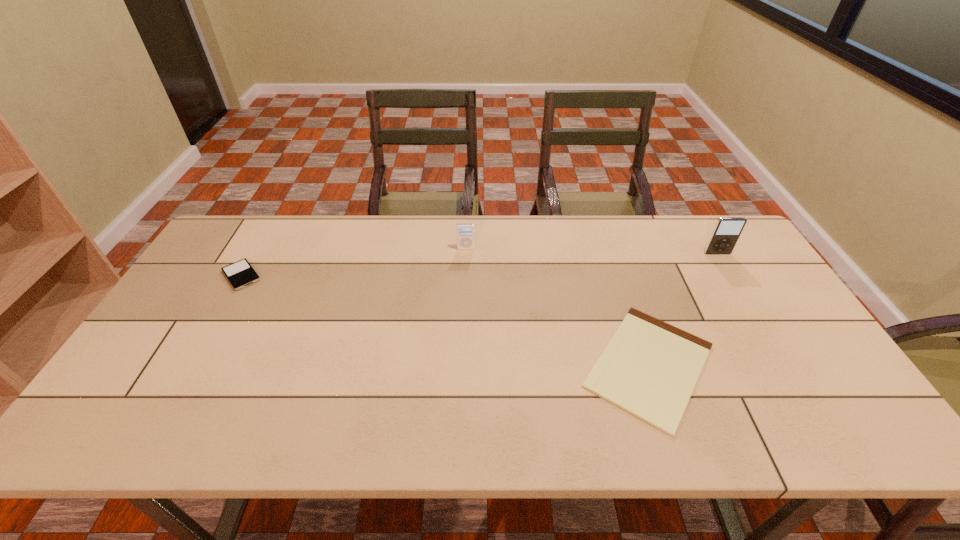
The image size is (960, 540). In the image, there is a desktop. Find the location of `free region at the far left corner`. free region at the far left corner is located at coordinates (219, 246).

The height and width of the screenshot is (540, 960). Find the location of `vacant region at the near left corner of the desktop`. vacant region at the near left corner of the desktop is located at coordinates (123, 432).

This screenshot has width=960, height=540. I want to click on vacant area that lies between the second nearest iPod and the shortest object, so click(684, 309).

Locate an element on the screen. empty space that is in between the clipboard and the second iPod from right to left is located at coordinates (558, 307).

Where is `free space between the nearest iPod and the second tallest iPod`? The height and width of the screenshot is (540, 960). free space between the nearest iPod and the second tallest iPod is located at coordinates (353, 262).

The height and width of the screenshot is (540, 960). I want to click on free area in between the second object from left to right and the tallest iPod, so (x=591, y=251).

Where is `free space between the third object from left to right and the second nearest iPod`? The height and width of the screenshot is (540, 960). free space between the third object from left to right and the second nearest iPod is located at coordinates (684, 309).

At what (x,y) coordinates should I click in order to perform the action: click on free space between the shortest object and the farthest object. Please return your answer as a coordinate pair (x, y). Looking at the image, I should click on (558, 307).

The height and width of the screenshot is (540, 960). What are the coordinates of `vacant space that's between the second farthest iPod and the clipboard` in the screenshot? It's located at (684, 309).

This screenshot has width=960, height=540. What are the coordinates of `empty space that is in between the second farthest iPod and the third tallest object` in the screenshot? It's located at (479, 265).